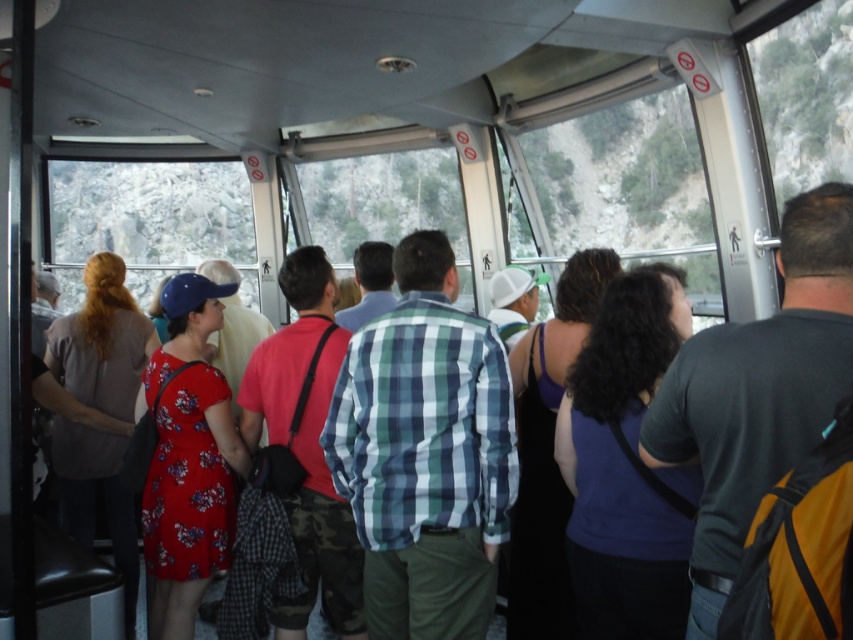
Question: Can you confirm if camo pants at center is wider than floral dress at left?

Choices:
 (A) yes
 (B) no

Answer: (B)

Question: Is dark gray backpack at center wider than floral dress at left?

Choices:
 (A) no
 (B) yes

Answer: (A)

Question: Which of these objects is positioned closest to the floral dress at left?

Choices:
 (A) floral dress at center
 (B) purple fabric top at center
 (C) green plaid shirt at center
 (D) blue fabric tank top at center

Answer: (A)

Question: Which object appears closest to the camera in this image?

Choices:
 (A) floral dress at left
 (B) purple fabric top at center
 (C) blue fabric tank top at center
 (D) camo pants at center

Answer: (C)

Question: Does green plaid shirt at center appear under purple fabric top at center?

Choices:
 (A) yes
 (B) no

Answer: (B)

Question: Among these objects, which one is farthest from the camera?

Choices:
 (A) camo pants at center
 (B) blue fabric tank top at center
 (C) dark gray backpack at center

Answer: (A)